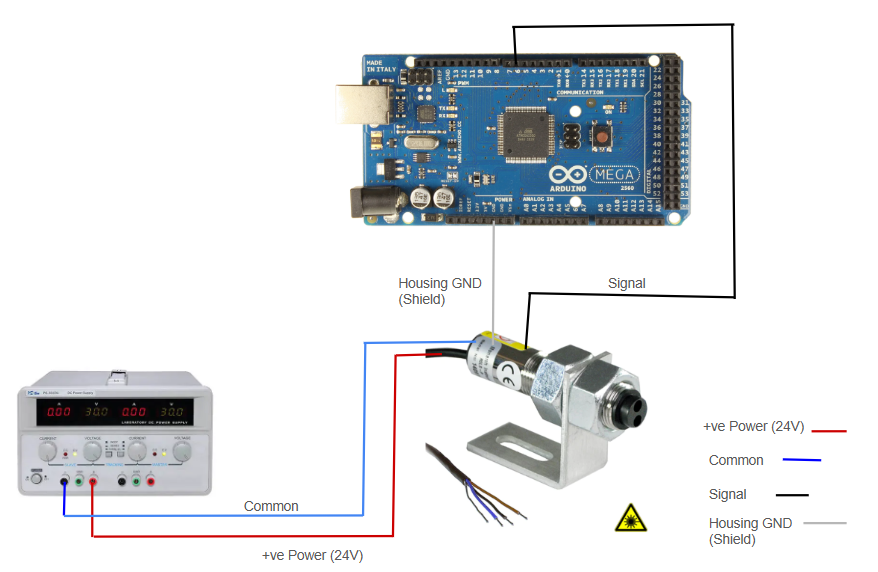
Where is `screen`? The image size is (878, 572). screen is located at coordinates (83, 411), (117, 413), (155, 414).